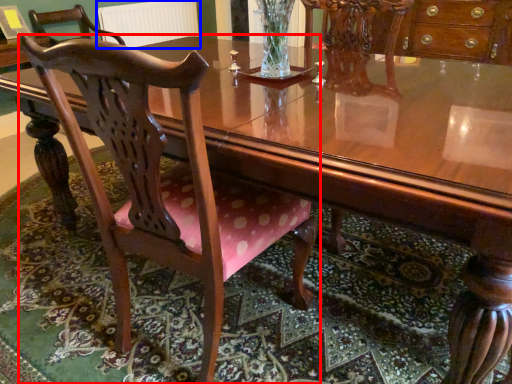
Question: Which of the following is the farthest to the observer, chair (highlighted by a red box) or radiator (highlighted by a blue box)?

Choices:
 (A) chair
 (B) radiator

Answer: (B)